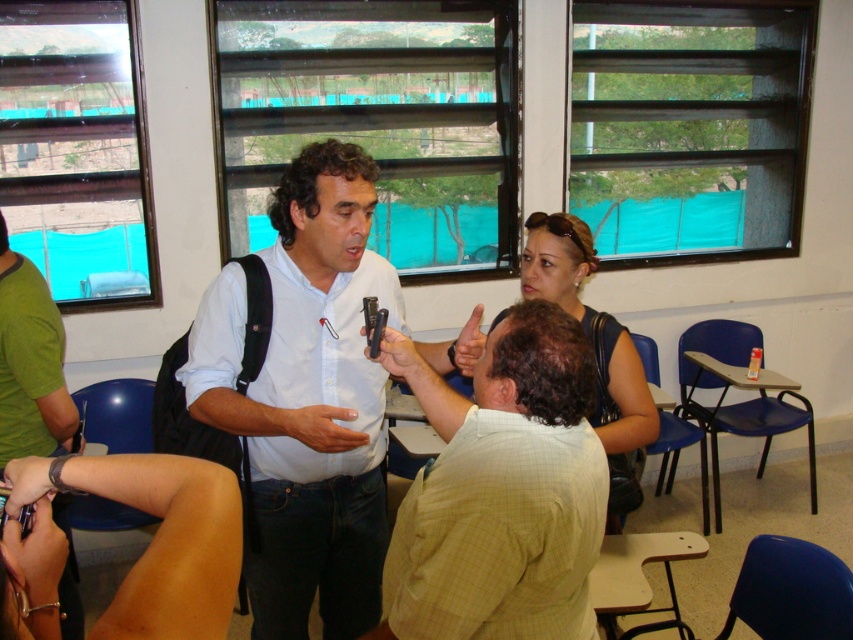
You are a photographer standing at the back of the room. You need to take a photo of both the white shirt at center and the smooth tan skin at lower left. Which subject should you focus on first to ensure both are in frame?

You should focus on the white shirt at center first because it is taller than the smooth tan skin at lower left, so it will be easier to frame both subjects by starting with the taller one.

You are a photographer in the room and want to take a picture of both the smooth skin hand at center and the matte black phone at center. Which object should you focus on first if you want to capture both in the same frame without moving the camera?

You should focus on the smooth skin hand at center first because it is closer to the camera than the matte black phone at center, allowing both to be in focus simultaneously.

You are a person standing in the classroom. You need to pass a note to someone without being noticed. The note is in your pocket, and you want to discreetly hand it to either the smooth tan skin at lower left or the matte black hand at center. Which object should you choose to minimize the distance you have to walk?

The smooth tan skin at lower left is 32.89 inches from the matte black hand at center. To minimize the distance walked, you should choose the matte black hand at center since it is closer to your current position at the center of the room compared to the smooth tan skin at lower left.